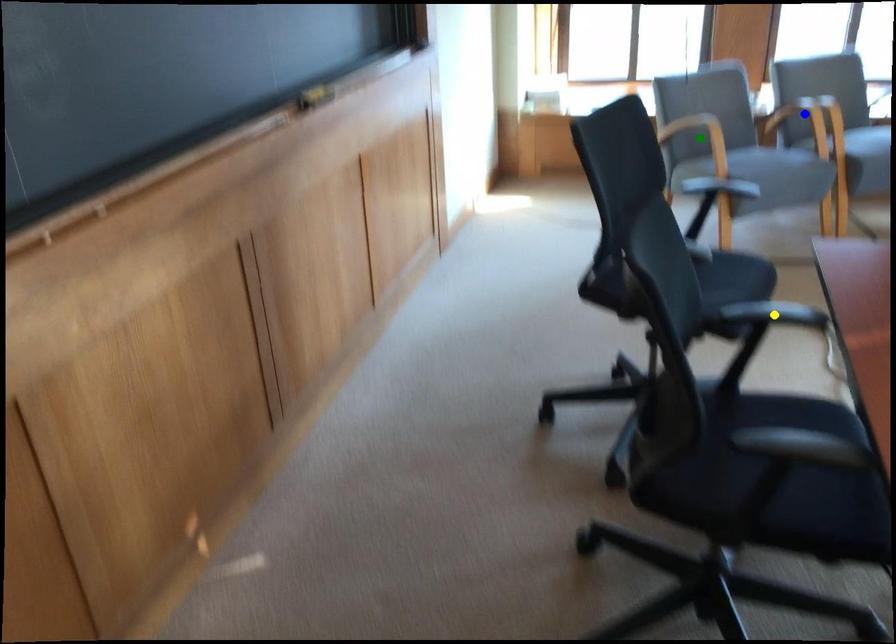
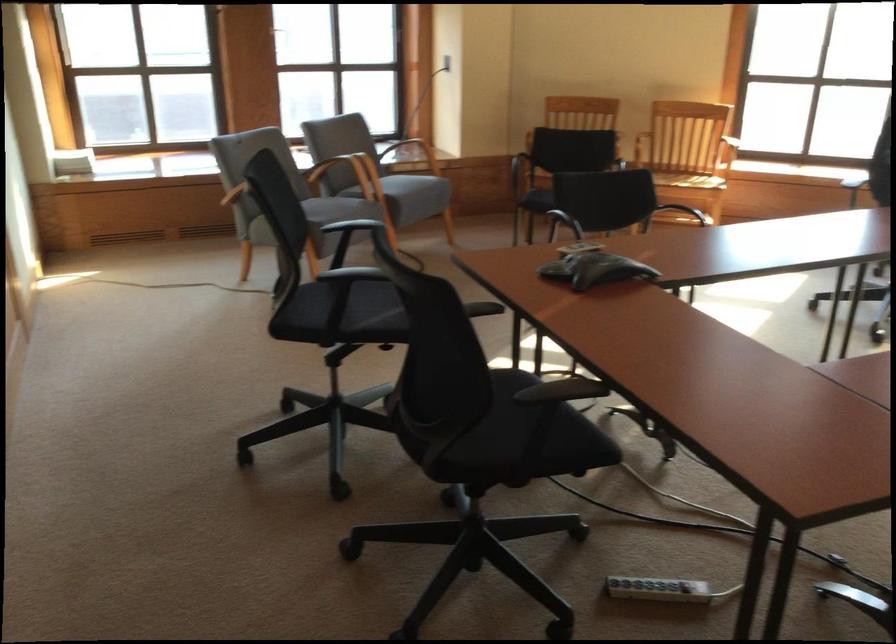
I am providing you with two images of the same scene from different viewpoints. Three points are marked in image1. Which point corresponds to a part or object that is occluded in image2?In image1, three points are marked. Which of them correspond to a part or object that is occluded in image2?Among the three points shown in image1, which one corresponds to a part or object that is no longer visible due to occlusion in image2?

yellow point, green point cannot be seen in image2.